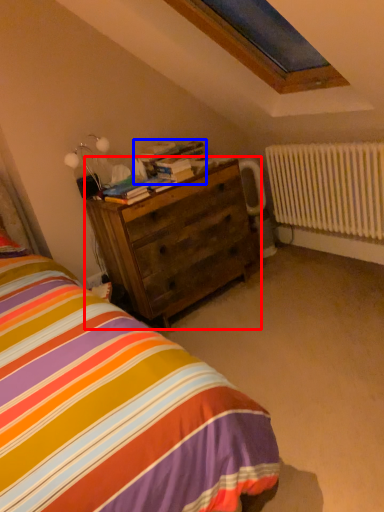
Question: Which object appears farthest to the camera in this image, chest of drawers (highlighted by a red box) or book (highlighted by a blue box)?

Choices:
 (A) chest of drawers
 (B) book

Answer: (B)